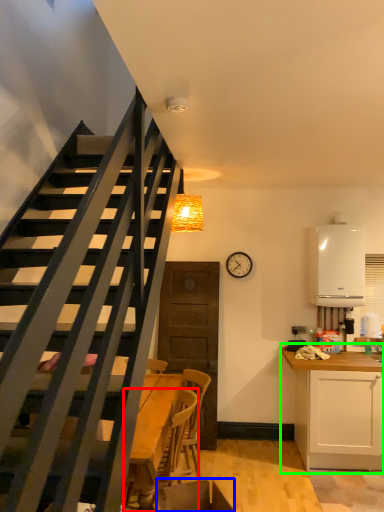
Question: Which object is positioned closest to chair (highlighted by a red box)? Select from swivel chair (highlighted by a blue box) and cabinetry (highlighted by a green box).

Choices:
 (A) swivel chair
 (B) cabinetry

Answer: (A)